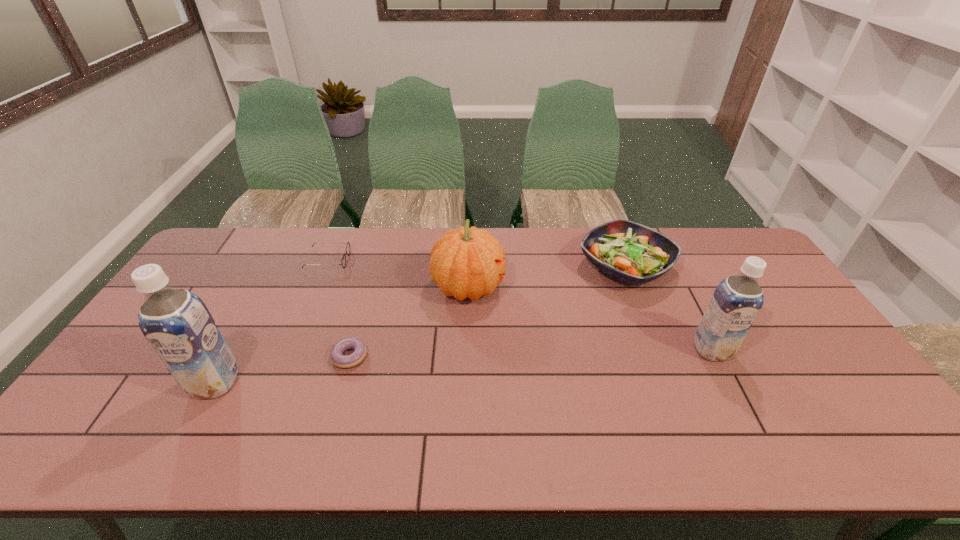
In the image, there is a desktop. Where is `vacant space at the far edge`? The height and width of the screenshot is (540, 960). vacant space at the far edge is located at coordinates (385, 241).

Identify the location of free space at the near edge. (716, 418).

In the image, there is a desktop. Identify the location of free space at the left edge. (136, 355).

In order to click on vacant space at the right edge of the desktop in this screenshot , I will do `click(788, 367)`.

The height and width of the screenshot is (540, 960). I want to click on vacant space at the far right corner of the desktop, so click(704, 233).

Find the location of a particular element. free space between the pumpkin and the salad plate is located at coordinates (547, 277).

Where is `blank region between the shortest object and the leftmost object`? blank region between the shortest object and the leftmost object is located at coordinates (282, 369).

The width and height of the screenshot is (960, 540). What are the coordinates of `vacant point located between the third object from left to right and the taller soya milk` in the screenshot? It's located at (282, 369).

This screenshot has height=540, width=960. In order to click on empty space between the farther soya milk and the fifth tallest object in this screenshot , I will do `click(519, 305)`.

This screenshot has height=540, width=960. I want to click on free space that is in between the fourth shortest object and the third object from left to right, so click(x=409, y=321).